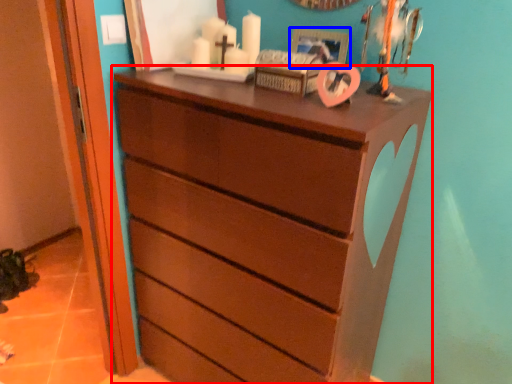
Question: Which object appears closest to the camera in this image, chest of drawers (highlighted by a red box) or picture frame (highlighted by a blue box)?

Choices:
 (A) chest of drawers
 (B) picture frame

Answer: (A)